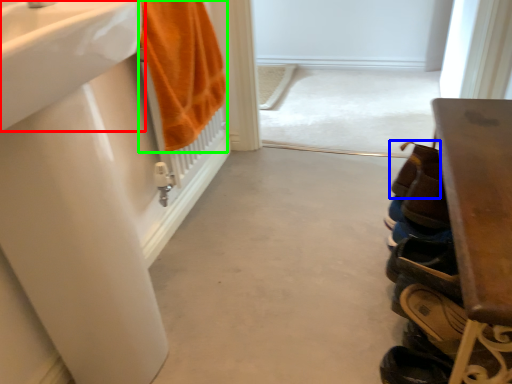
Question: Which object is positioned closest to sink (highlighted by a red box)? Select from shoe (highlighted by a blue box) and bath towel (highlighted by a green box).

Choices:
 (A) shoe
 (B) bath towel

Answer: (B)